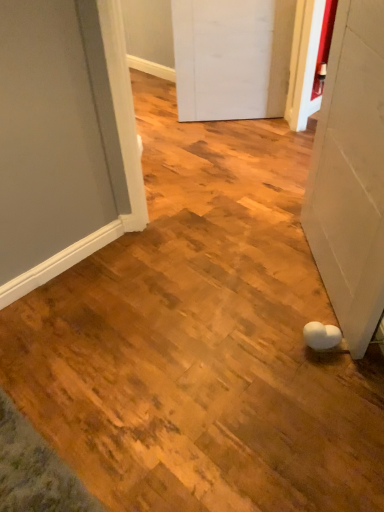
The image size is (384, 512). I want to click on white matte door at center, which ranks as the 2th door in bottom-to-top order, so [x=232, y=58].

The width and height of the screenshot is (384, 512). Describe the element at coordinates (232, 58) in the screenshot. I see `white matte door at center, marked as the first door in a top-to-bottom arrangement` at that location.

Measure the distance between point (334, 247) and camera.

1.50 meters.

The width and height of the screenshot is (384, 512). Describe the element at coordinates (351, 174) in the screenshot. I see `white matte door at lower right, acting as the first door starting from the bottom` at that location.

Identify the location of white matte door at lower right, the 1th door from the front. (351, 174).

Identify the location of white matte door at center, which is the 2th door in front-to-back order. The height and width of the screenshot is (512, 384). (232, 58).

Visually, is white matte door at lower right, marked as the 2th door in a back-to-front arrangement, positioned to the left or to the right of white matte door at center, which ranks as the 2th door in bottom-to-top order?

white matte door at lower right, marked as the 2th door in a back-to-front arrangement, is positioned on white matte door at center, which ranks as the 2th door in bottom-to-top order,'s right side.

Is white matte door at lower right, the 1th door from the front, in front of white matte door at center, the first door when ordered from back to front?

Yes, it is in front of white matte door at center, the first door when ordered from back to front.

Considering the points (338, 293) and (193, 33), which point is behind, point (338, 293) or point (193, 33)?

Point (193, 33)

From the image's perspective, is white matte door at lower right, acting as the first door starting from the bottom, positioned above or below white matte door at center, marked as the first door in a top-to-bottom arrangement?

white matte door at lower right, acting as the first door starting from the bottom, is situated lower than white matte door at center, marked as the first door in a top-to-bottom arrangement, in the image.

From a real-world perspective, does white matte door at lower right, marked as the 2th door in a back-to-front arrangement, sit lower than white matte door at center, the first door when ordered from back to front?

Actually, white matte door at lower right, marked as the 2th door in a back-to-front arrangement, is physically above white matte door at center, the first door when ordered from back to front, in the real world.

Is white matte door at lower right, marked as the 2th door in a back-to-front arrangement, wider than white matte door at center, which is the 2th door in front-to-back order?

Correct, the width of white matte door at lower right, marked as the 2th door in a back-to-front arrangement, exceeds that of white matte door at center, which is the 2th door in front-to-back order.

Considering the relative sizes of white matte door at lower right, acting as the first door starting from the bottom, and white matte door at center, marked as the first door in a top-to-bottom arrangement, in the image provided, is white matte door at lower right, acting as the first door starting from the bottom, shorter than white matte door at center, marked as the first door in a top-to-bottom arrangement,?

No, white matte door at lower right, acting as the first door starting from the bottom, is not shorter than white matte door at center, marked as the first door in a top-to-bottom arrangement.

Does white matte door at lower right, acting as the first door starting from the bottom, have a smaller size compared to white matte door at center, which ranks as the 2th door in bottom-to-top order?

No, white matte door at lower right, acting as the first door starting from the bottom, is not smaller than white matte door at center, which ranks as the 2th door in bottom-to-top order.

Is white matte door at lower right, marked as the 2th door in a back-to-front arrangement, completely or partially outside of white matte door at center, which is the 2th door in front-to-back order?

Yes, white matte door at lower right, marked as the 2th door in a back-to-front arrangement, is not within white matte door at center, which is the 2th door in front-to-back order.

Is white matte door at lower right, which is the second door from top to bottom, not close to white matte door at center, which is the 2th door in front-to-back order?

Yes, white matte door at lower right, which is the second door from top to bottom, and white matte door at center, which is the 2th door in front-to-back order, are located far from each other.

Is white matte door at lower right, the 1th door from the front, positioned with its back to white matte door at center, which is the 2th door in front-to-back order?

That's not correct — white matte door at lower right, the 1th door from the front, is not looking away from white matte door at center, which is the 2th door in front-to-back order.

What's the angular difference between white matte door at lower right, acting as the first door starting from the bottom, and white matte door at center, which ranks as the 2th door in bottom-to-top order,'s facing directions?

They differ by 89.4 degrees in their facing directions.

The width and height of the screenshot is (384, 512). In order to click on door that appears on the left of white matte door at lower right, acting as the first door starting from the bottom in this screenshot , I will do `click(232, 58)`.

Considering the positions of objects white matte door at center, marked as the first door in a top-to-bottom arrangement, and white matte door at lower right, the 1th door from the front, in the image provided, who is more to the right, white matte door at center, marked as the first door in a top-to-bottom arrangement, or white matte door at lower right, the 1th door from the front,?

white matte door at lower right, the 1th door from the front, is more to the right.

Is the position of white matte door at center, which ranks as the 2th door in bottom-to-top order, less distant than that of white matte door at lower right, marked as the 2th door in a back-to-front arrangement?

No, white matte door at center, which ranks as the 2th door in bottom-to-top order, is further to the viewer.

Is point (175, 28) closer to viewer compared to point (334, 197)?

That is False.

From the image's perspective, would you say white matte door at center, marked as the first door in a top-to-bottom arrangement, is shown under white matte door at lower right, marked as the 2th door in a back-to-front arrangement?

No, from the image's perspective, white matte door at center, marked as the first door in a top-to-bottom arrangement, is not beneath white matte door at lower right, marked as the 2th door in a back-to-front arrangement.

From a real-world perspective, between white matte door at center, marked as the first door in a top-to-bottom arrangement, and white matte door at lower right, the 1th door from the front, who is vertically lower?

white matte door at center, marked as the first door in a top-to-bottom arrangement.

In the scene shown: Can you confirm if white matte door at center, which ranks as the 2th door in bottom-to-top order, is thinner than white matte door at lower right, acting as the first door starting from the bottom?

Yes.

Which of these two, white matte door at center, marked as the first door in a top-to-bottom arrangement, or white matte door at lower right, marked as the 2th door in a back-to-front arrangement, stands taller?

With more height is white matte door at lower right, marked as the 2th door in a back-to-front arrangement.

Does white matte door at center, which is the 2th door in front-to-back order, have a larger size compared to white matte door at lower right, acting as the first door starting from the bottom?

Actually, white matte door at center, which is the 2th door in front-to-back order, might be smaller than white matte door at lower right, acting as the first door starting from the bottom.

Looking at this image, is white matte door at center, which ranks as the 2th door in bottom-to-top order, spatially inside white matte door at lower right, the 1th door from the front, or outside of it?

white matte door at center, which ranks as the 2th door in bottom-to-top order, cannot be found inside white matte door at lower right, the 1th door from the front.

Would you consider white matte door at center, the first door when ordered from back to front, to be distant from white matte door at lower right, the 1th door from the front?

That's right, there is a large distance between white matte door at center, the first door when ordered from back to front, and white matte door at lower right, the 1th door from the front.

Consider the image. Could you tell me if white matte door at center, which ranks as the 2th door in bottom-to-top order, is facing white matte door at lower right, acting as the first door starting from the bottom?

Yes, white matte door at center, which ranks as the 2th door in bottom-to-top order, is facing white matte door at lower right, acting as the first door starting from the bottom.

Could you measure the distance between white matte door at center, marked as the first door in a top-to-bottom arrangement, and white matte door at lower right, the 1th door from the front?

white matte door at center, marked as the first door in a top-to-bottom arrangement, and white matte door at lower right, the 1th door from the front, are 4.35 feet apart.

This screenshot has width=384, height=512. I want to click on door on the right of white matte door at center, marked as the first door in a top-to-bottom arrangement, so click(x=351, y=174).

Where is `door above the white matte door at center, the first door when ordered from back to front (from a real-world perspective)`? door above the white matte door at center, the first door when ordered from back to front (from a real-world perspective) is located at coordinates (351, 174).

Identify the location of door located in front of the white matte door at center, marked as the first door in a top-to-bottom arrangement. (351, 174).